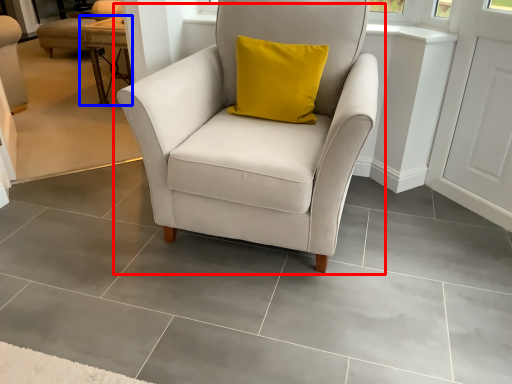
Question: Which object appears closest to the camera in this image, chair (highlighted by a red box) or table (highlighted by a blue box)?

Choices:
 (A) chair
 (B) table

Answer: (A)